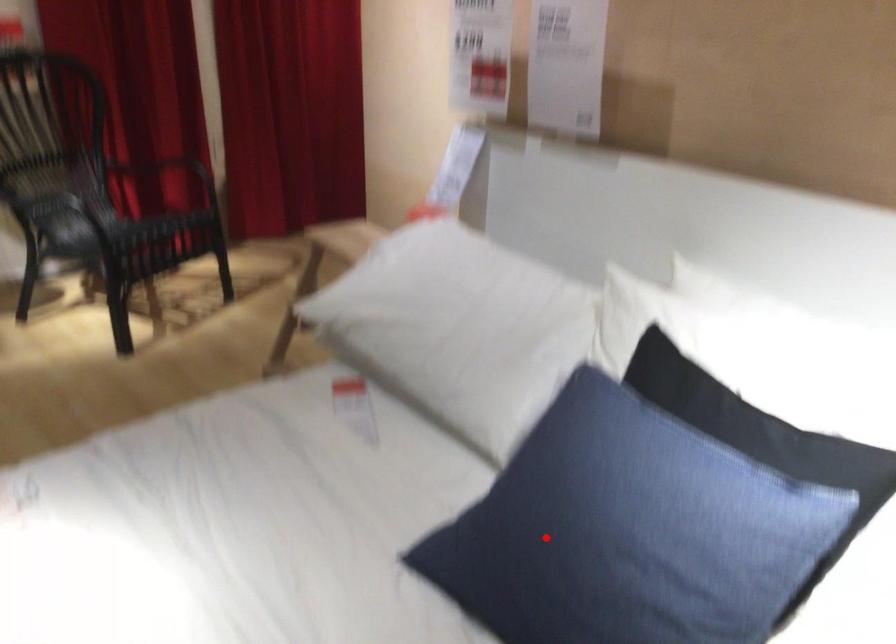
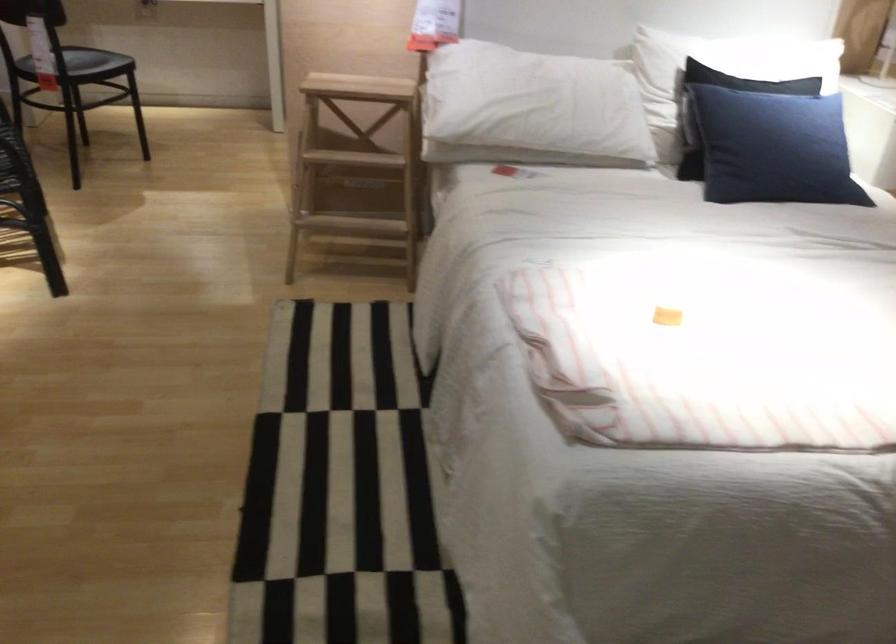
Locate, in the second image, the point that corresponds to the highlighted location in the first image.

(773, 147)